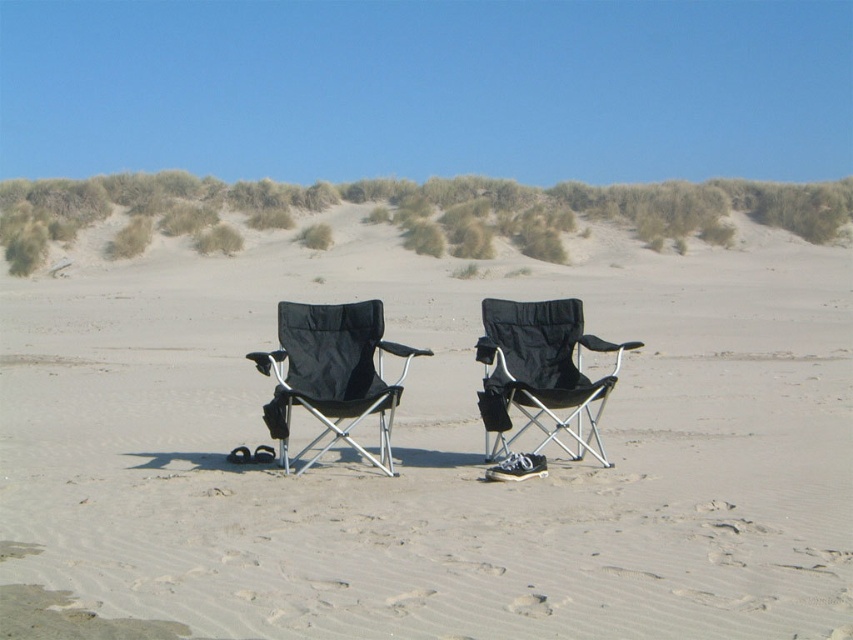
You are a beachgoer who wants to set up a towel between the two black fabric chairs at center and the black fabric chair at center. According to the scene, which chair should you place the towel closer to?

The black fabric chairs at center is located above the black fabric chair at center, so you should place the towel closer to the black fabric chair at center to position it between them.

You are planning to set up a small tent between the green grassy dune at upper center and the black fabric chair at center. Given that the tent requires a minimum of 150 feet of space to be safely anchored, will there be enough space between them?

The distance between the green grassy dune at upper center and the black fabric chair at center is 143.86 feet, which is less than the required 150 feet. Therefore, there is not enough space to safely anchor the tent between them.